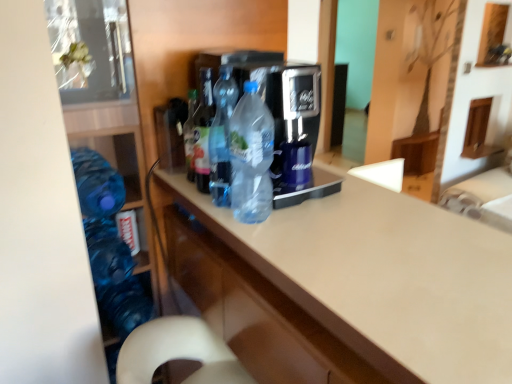
Question: Should I look upward or downward to see translucent plastic bottle at center, the 2th bottle viewed from the right?

Choices:
 (A) down
 (B) up

Answer: (B)

Question: Can you confirm if beige laminate countertop at center is positioned to the left of translucent plastic bottle at center, arranged as the third bottle when viewed from the right?

Choices:
 (A) yes
 (B) no

Answer: (B)

Question: From the image's perspective, is beige laminate countertop at center on translucent plastic bottle at center, arranged as the third bottle when viewed from the right?

Choices:
 (A) no
 (B) yes

Answer: (A)

Question: Is the position of beige laminate countertop at center more distant than that of translucent plastic bottle at center, arranged as the third bottle when viewed from the right?

Choices:
 (A) yes
 (B) no

Answer: (B)

Question: Does beige laminate countertop at center have a smaller size compared to translucent plastic bottle at center, the 2th bottle when ordered from left to right?

Choices:
 (A) no
 (B) yes

Answer: (A)

Question: Is beige laminate countertop at center not close to translucent plastic bottle at center, arranged as the third bottle when viewed from the right?

Choices:
 (A) yes
 (B) no

Answer: (B)

Question: Is beige laminate countertop at center shorter than translucent plastic bottle at center, the 2th bottle when ordered from left to right?

Choices:
 (A) yes
 (B) no

Answer: (B)

Question: Considering the relative sizes of translucent plastic bottle at center, the third bottle when ordered from left to right, and transparent plastic bottles at center in the image provided, is translucent plastic bottle at center, the third bottle when ordered from left to right, taller than transparent plastic bottles at center?

Choices:
 (A) no
 (B) yes

Answer: (A)

Question: From a real-world perspective, is translucent plastic bottle at center, the third bottle when ordered from left to right, on top of transparent plastic bottles at center?

Choices:
 (A) yes
 (B) no

Answer: (B)

Question: Is translucent plastic bottle at center, the 2th bottle viewed from the right, located outside transparent plastic bottles at center?

Choices:
 (A) no
 (B) yes

Answer: (A)

Question: Does translucent plastic bottle at center, the third bottle when ordered from left to right, appear on the left side of transparent plastic bottles at center?

Choices:
 (A) no
 (B) yes

Answer: (B)

Question: From a real-world perspective, does translucent plastic bottle at center, the third bottle when ordered from left to right, sit lower than transparent plastic bottles at center?

Choices:
 (A) no
 (B) yes

Answer: (B)

Question: Considering the relative sizes of translucent plastic bottle at center, the third bottle when ordered from left to right, and transparent plastic bottles at center in the image provided, is translucent plastic bottle at center, the third bottle when ordered from left to right, smaller than transparent plastic bottles at center?

Choices:
 (A) yes
 (B) no

Answer: (A)

Question: Considering the relative sizes of translucent plastic bottle at center, the third bottle when ordered from left to right, and translucent plastic bottle at center, the 2th bottle when ordered from left to right, in the image provided, is translucent plastic bottle at center, the third bottle when ordered from left to right, bigger than translucent plastic bottle at center, the 2th bottle when ordered from left to right,?

Choices:
 (A) no
 (B) yes

Answer: (B)